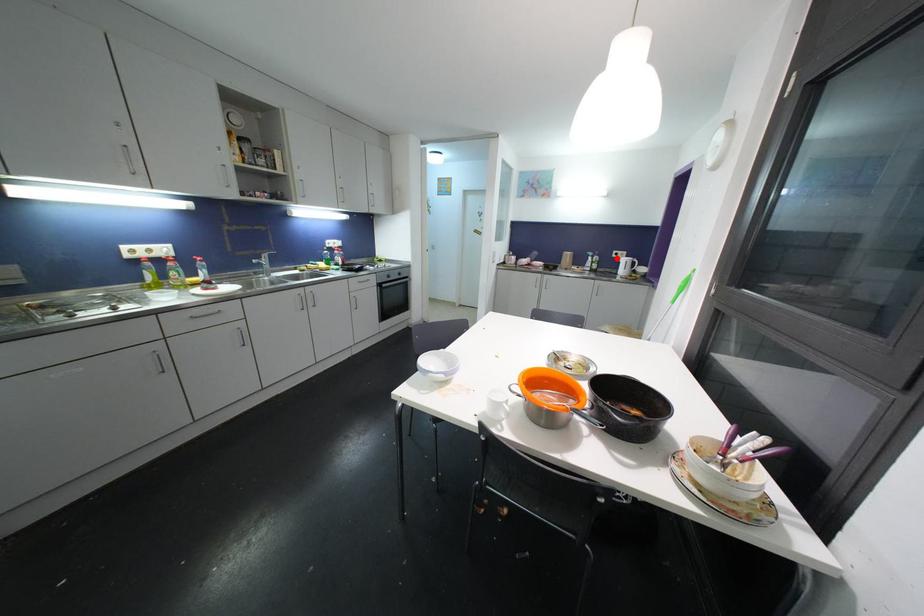
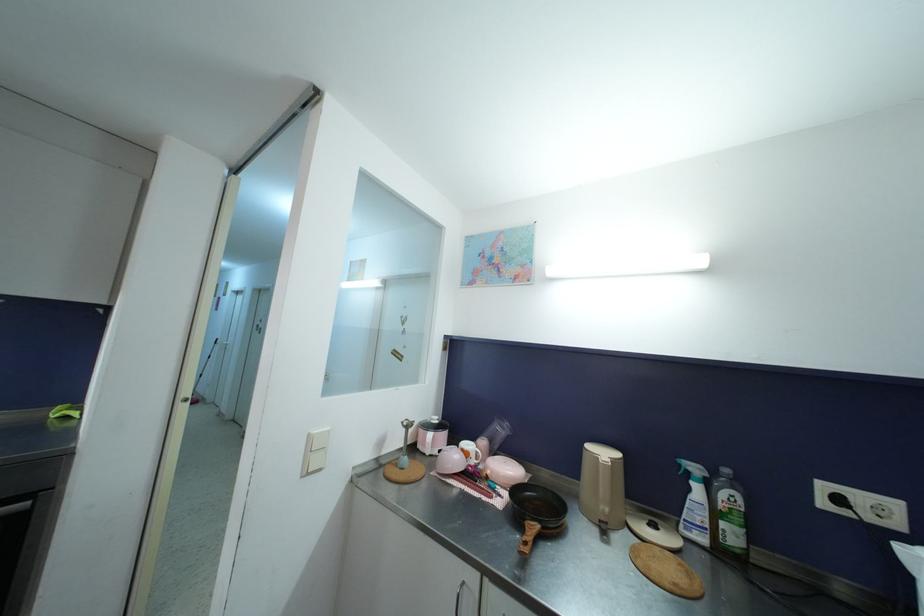
In the second image, find the point that corresponds to the highlighted location in the first image.

(827, 507)